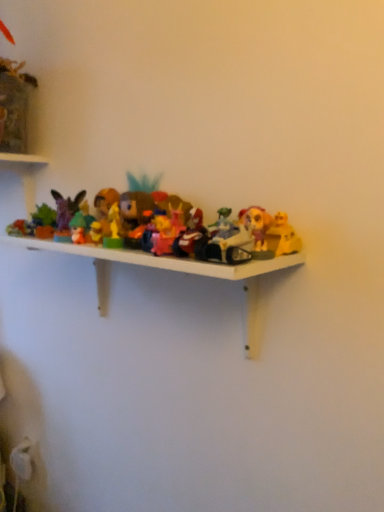
Question: Considering the relative positions of green matte figurine at center, positioned as the sixth toy in right-to-left order, and shiny silver motorcycle at center, the second toy in the right-to-left sequence, in the image provided, is green matte figurine at center, positioned as the sixth toy in right-to-left order, to the left of shiny silver motorcycle at center, the second toy in the right-to-left sequence, from the viewer's perspective?

Choices:
 (A) no
 (B) yes

Answer: (B)

Question: Does green matte figurine at center, positioned as the sixth toy in right-to-left order, have a lesser height compared to shiny silver motorcycle at center, the second toy in the right-to-left sequence?

Choices:
 (A) no
 (B) yes

Answer: (B)

Question: Is green matte figurine at center, positioned as the sixth toy in right-to-left order, wider than shiny silver motorcycle at center, the second toy in the right-to-left sequence?

Choices:
 (A) yes
 (B) no

Answer: (B)

Question: From a real-world perspective, is green matte figurine at center, which ranks as the second toy in left-to-right order, on top of shiny silver motorcycle at center, which is counted as the 6th toy, starting from the left?

Choices:
 (A) yes
 (B) no

Answer: (B)

Question: From the image's perspective, is green matte figurine at center, positioned as the sixth toy in right-to-left order, under shiny silver motorcycle at center, which is counted as the 6th toy, starting from the left?

Choices:
 (A) no
 (B) yes

Answer: (A)

Question: From the image's perspective, is matte purple figurine at left, the 1th toy positioned from the left, positioned above or below pink plastic toy at center, the fourth toy from the left?

Choices:
 (A) below
 (B) above

Answer: (B)

Question: Considering their positions, is matte purple figurine at left, the 1th toy positioned from the left, located in front of or behind pink plastic toy at center, which appears as the fourth toy when viewed from the right?

Choices:
 (A) behind
 (B) front

Answer: (A)

Question: In the image, is matte purple figurine at left, which ranks as the seventh toy in right-to-left order, on the left side or the right side of pink plastic toy at center, the fourth toy from the left?

Choices:
 (A) right
 (B) left

Answer: (B)

Question: Considering the positions of matte purple figurine at left, the 1th toy positioned from the left, and pink plastic toy at center, which appears as the fourth toy when viewed from the right, in the image, is matte purple figurine at left, the 1th toy positioned from the left, taller or shorter than pink plastic toy at center, which appears as the fourth toy when viewed from the right,?

Choices:
 (A) short
 (B) tall

Answer: (B)

Question: In terms of size, does matte plastic toy at center, the 5th toy viewed from the right, appear bigger or smaller than yellow plastic toy at right, which is counted as the first toy, starting from the right?

Choices:
 (A) big
 (B) small

Answer: (B)

Question: Visually, is matte plastic toy at center, which is the third toy from left to right, positioned to the left or to the right of yellow plastic toy at right, which is counted as the first toy, starting from the right?

Choices:
 (A) right
 (B) left

Answer: (B)

Question: From the image's perspective, is matte plastic toy at center, the 5th toy viewed from the right, above or below yellow plastic toy at right, which is counted as the first toy, starting from the right?

Choices:
 (A) below
 (B) above

Answer: (B)

Question: From a real-world perspective, is matte plastic toy at center, which is the third toy from left to right, physically located above or below yellow plastic toy at right, the seventh toy when ordered from left to right?

Choices:
 (A) above
 (B) below

Answer: (B)

Question: From their relative heights in the image, would you say matte purple figurine at left, the 1th toy positioned from the left, is taller or shorter than matte plastic toy at center, acting as the fifth toy starting from the left?

Choices:
 (A) tall
 (B) short

Answer: (A)

Question: Would you say matte purple figurine at left, the 1th toy positioned from the left, is to the left or to the right of matte plastic toy at center, the third toy positioned from the right, in the picture?

Choices:
 (A) left
 (B) right

Answer: (A)